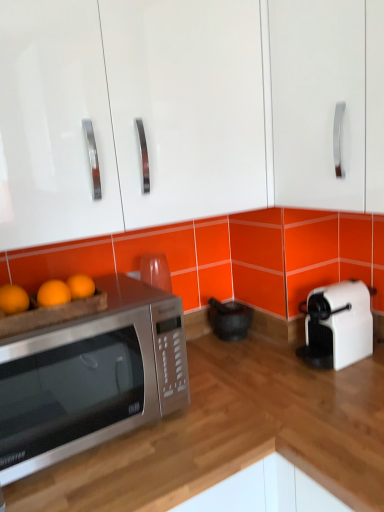
The height and width of the screenshot is (512, 384). I want to click on vacant area on top of silver metallic microwave at lower left (from a real-world perspective), so click(124, 452).